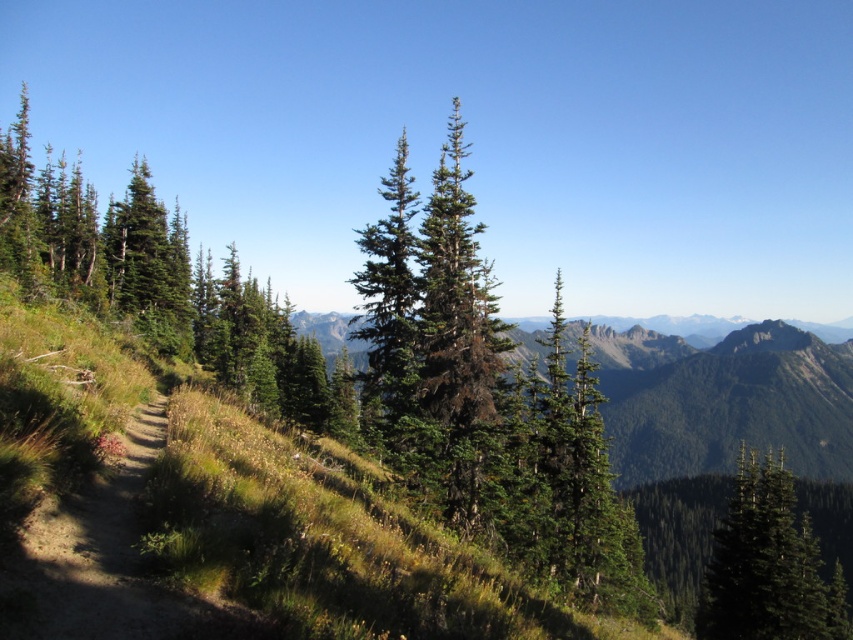
You are standing at the point marked by the coordinates point [161,284] in the image. What type of tree are you facing? Please describe its characteristics based on the scene description.

The point [161,284] indicates a green needlelike tree at centerleft. This tree has dense foliage with needlelike leaves, typical of coniferous evergreen trees. The scene description mentions tall evergreen trees with dense foliage in shades of green, including darker brownish hues, suggesting this tree is part of that group. It likely has a conical shape common in conifers and may cast shadows due to its dense canopy.